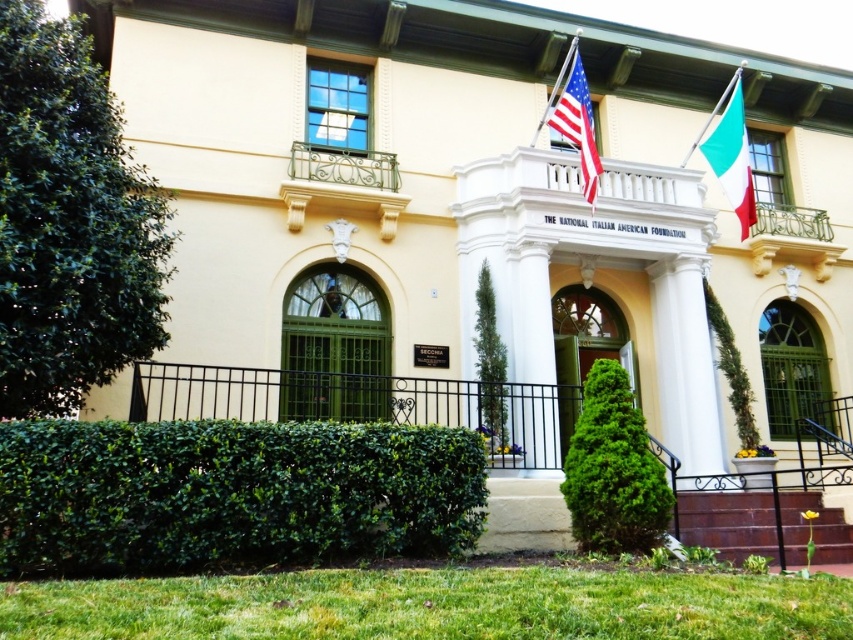
You are standing at the entrance of The National Italian American Foundation building. You notice two points marked on the wall. The first point is at coordinates point (489, 291) and the second is at point (596, 166). From your current position, which point is closer to you?

Point (596, 166) is closer to you because it is in front of point (489, 291) according to their spatial arrangement.

You are standing in front of The National Italian American Foundation building and want to take a photo. You notice two points marked at coordinates point (67, 92) and point (730, 529). Which point is closer to your camera when taking the photo?

Point (67, 92) is closer to the camera than point (730, 529).

You are planning to place a new bench in front of the National Italian American Foundation building. The bench requires a space wider than the green leafy hedge at left. Can the brown wooden stairs at lower right provide enough width for the bench?

The green leafy hedge at left has a lesser width compared to brown wooden stairs at lower right, so the brown wooden stairs at lower right can provide enough width for the bench since it is wider than the green leafy hedge at left.